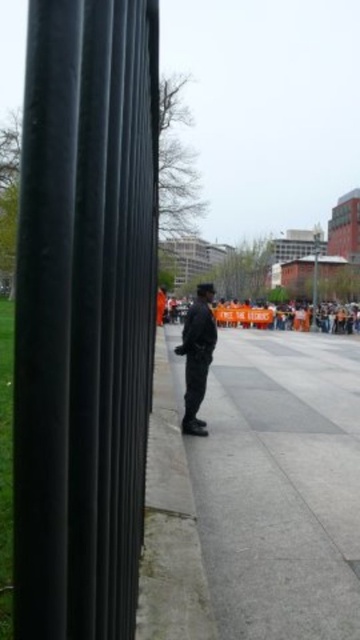
You are a delivery robot navigating an urban area. You need to deliver a package to the gray concrete curb at center. You are currently on the gray concrete sidewalk at center. Can you move directly to the curb without leaving the sidewalk?

The gray concrete sidewalk at center is larger in size than gray concrete curb at center, so the robot can move directly to the curb without leaving the sidewalk since the sidewalk provides enough space to maneuver.

You are a photographer setting up a tripod to capture the protest scene. The tripod requires a base that is wider than the black matte pole at left. Can the gray concrete sidewalk at center provide a stable base for the tripod?

The black matte pole at left is thinner than the gray concrete sidewalk at center, so the gray concrete sidewalk at center can provide a stable base for the tripod since it is wider.